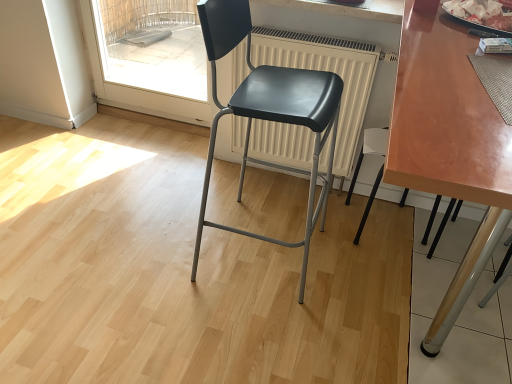
Locate an element on the screen. vacant area that is situated to the right of matte black chair at lower right, which appears as the 2th chair when viewed from the left is located at coordinates (456, 244).